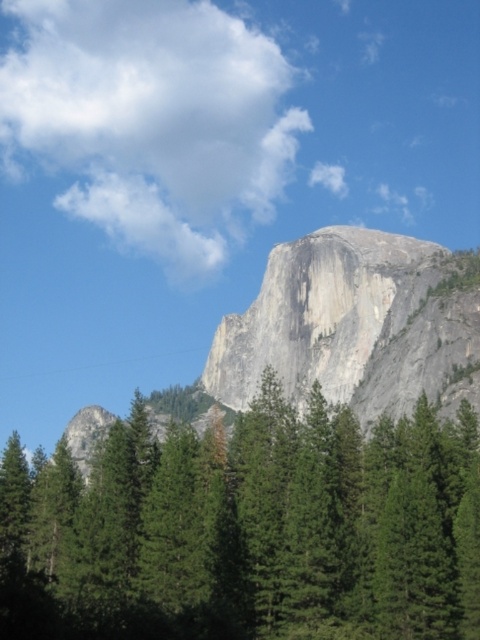
You are standing at the base of the granite rock formation in the image. Looking towards the center of the scene, you see a point marked at coordinates (248,529). What do you observe at that location?

The point at coordinates (248,529) corresponds to green matte trees at center.